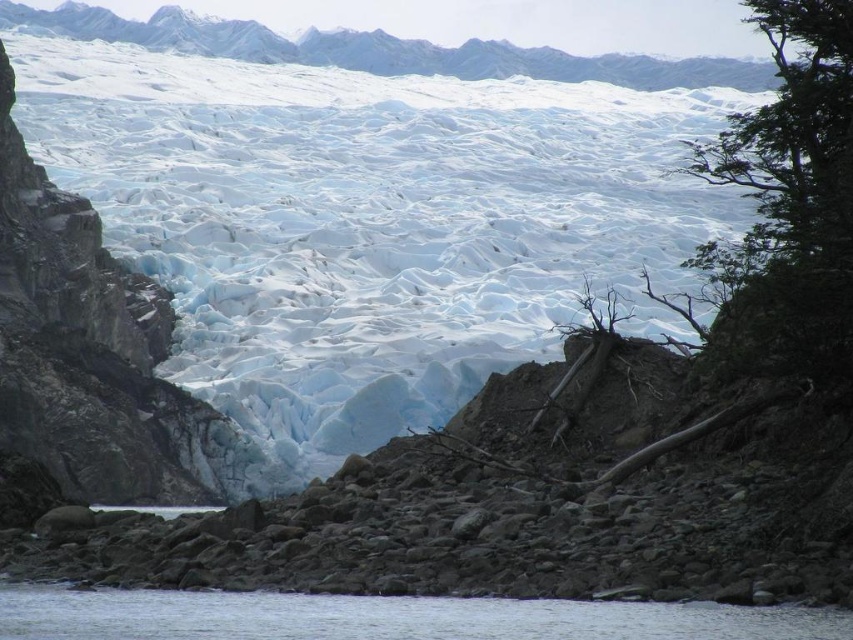
The width and height of the screenshot is (853, 640). What do you see at coordinates (387, 618) in the screenshot? I see `clear water at lower center` at bounding box center [387, 618].

Does clear water at lower center have a larger size compared to white ice mountain at upper center?

No, clear water at lower center is not bigger than white ice mountain at upper center.

Is point (312, 625) in front of point (241, 42)?

That is True.

Locate an element on the screen. The height and width of the screenshot is (640, 853). clear water at lower center is located at coordinates (387, 618).